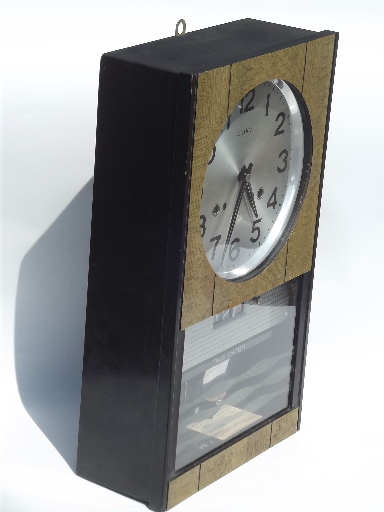
Where is `hook`? hook is located at coordinates (183, 26).